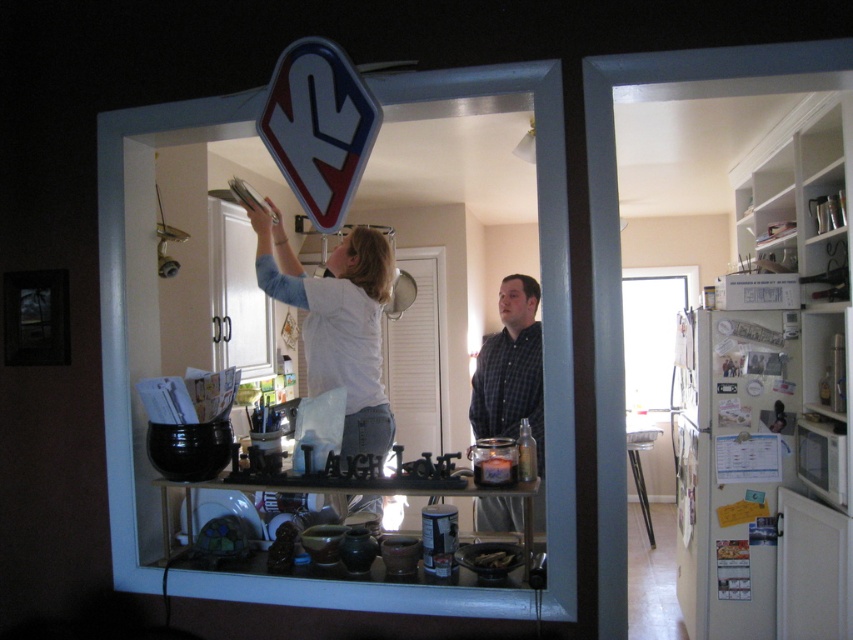
Is white matte shirt at upper center to the right of checkered fabric shirt at center from the viewer's perspective?

In fact, white matte shirt at upper center is to the left of checkered fabric shirt at center.

Is white matte shirt at upper center shorter than checkered fabric shirt at center?

Yes, white matte shirt at upper center is shorter than checkered fabric shirt at center.

Who is more forward, (363, 262) or (469, 416)?

Positioned in front is point (363, 262).

This screenshot has width=853, height=640. I want to click on white matte shirt at upper center, so click(334, 314).

Between white matte shirt at upper center and metallic blue and white traffic sign at upper center, which one appears on the right side from the viewer's perspective?

metallic blue and white traffic sign at upper center is more to the right.

Measure the distance between white matte shirt at upper center and camera.

white matte shirt at upper center and camera are 2.24 meters apart from each other.

Identify the location of white matte shirt at upper center. (334, 314).

Who is taller, metallic blue and white traffic sign at upper center or checkered fabric shirt at center?

Standing taller between the two is checkered fabric shirt at center.

Is metallic blue and white traffic sign at upper center thinner than checkered fabric shirt at center?

Correct, metallic blue and white traffic sign at upper center's width is less than checkered fabric shirt at center's.

Where is `metallic blue and white traffic sign at upper center`? metallic blue and white traffic sign at upper center is located at coordinates pyautogui.click(x=318, y=128).

The image size is (853, 640). I want to click on metallic blue and white traffic sign at upper center, so click(x=318, y=128).